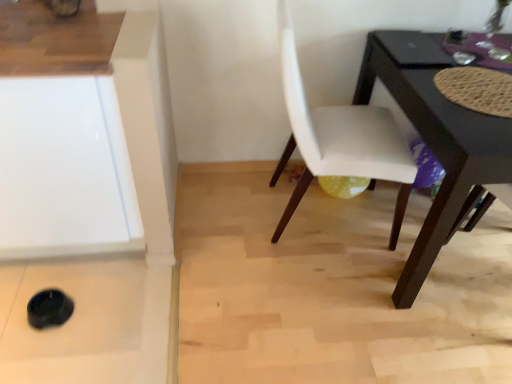
Question: Is glossy black table at lower right aimed at white leather chair at center?

Choices:
 (A) no
 (B) yes

Answer: (A)

Question: From the image's perspective, is glossy black table at lower right above white leather chair at center?

Choices:
 (A) no
 (B) yes

Answer: (A)

Question: Is glossy black table at lower right positioned with its back to white leather chair at center?

Choices:
 (A) no
 (B) yes

Answer: (A)

Question: Can white leather chair at center be found inside glossy black table at lower right?

Choices:
 (A) no
 (B) yes

Answer: (A)

Question: From a real-world perspective, is glossy black table at lower right under white leather chair at center?

Choices:
 (A) no
 (B) yes

Answer: (B)

Question: Is glossy black table at lower right located outside white leather chair at center?

Choices:
 (A) yes
 (B) no

Answer: (A)

Question: From the image's perspective, is white glossy cabinet at lower left below white leather chair at center?

Choices:
 (A) no
 (B) yes

Answer: (B)

Question: From a real-world perspective, is white glossy cabinet at lower left under white leather chair at center?

Choices:
 (A) yes
 (B) no

Answer: (A)

Question: Does white glossy cabinet at lower left have a lesser height compared to white leather chair at center?

Choices:
 (A) yes
 (B) no

Answer: (A)

Question: Does white glossy cabinet at lower left touch white leather chair at center?

Choices:
 (A) no
 (B) yes

Answer: (A)

Question: Is white glossy cabinet at lower left wider than white leather chair at center?

Choices:
 (A) yes
 (B) no

Answer: (A)

Question: From the image's perspective, is white glossy cabinet at lower left on top of white leather chair at center?

Choices:
 (A) yes
 (B) no

Answer: (B)

Question: From the image's perspective, does white leather chair at center appear lower than glossy black table at lower right?

Choices:
 (A) no
 (B) yes

Answer: (A)